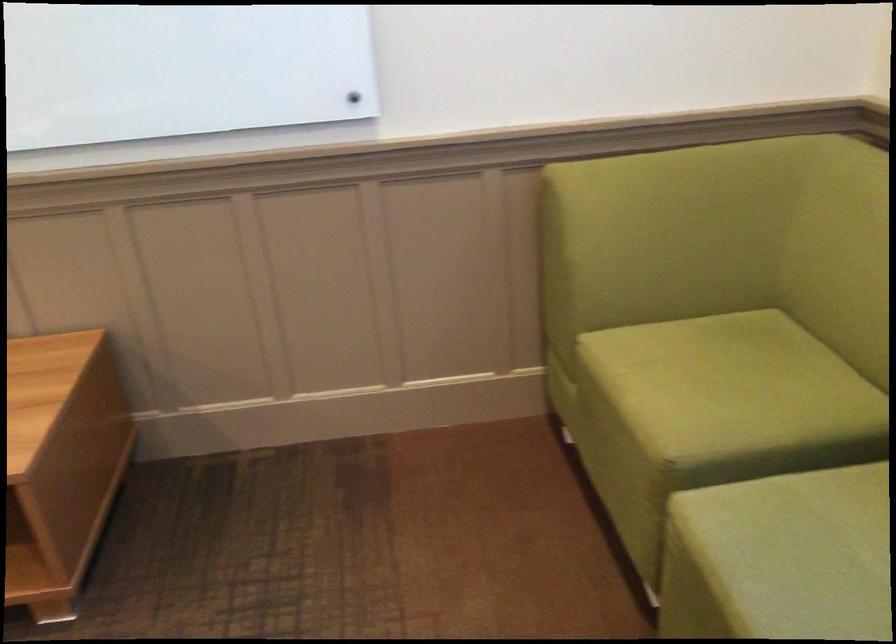
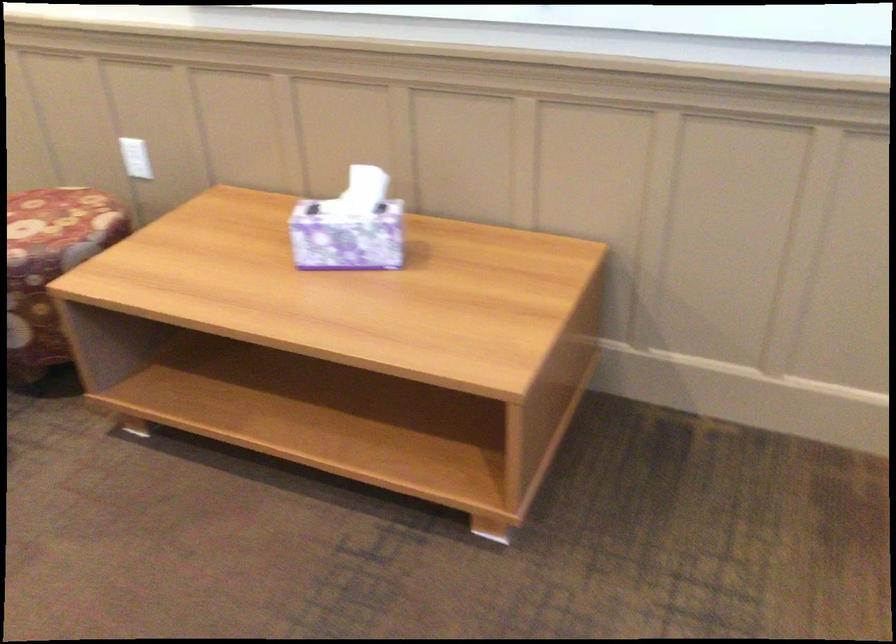
Question: How did the camera likely rotate?

Choices:
 (A) Left
 (B) Right
 (C) Up
 (D) Down

Answer: (A)